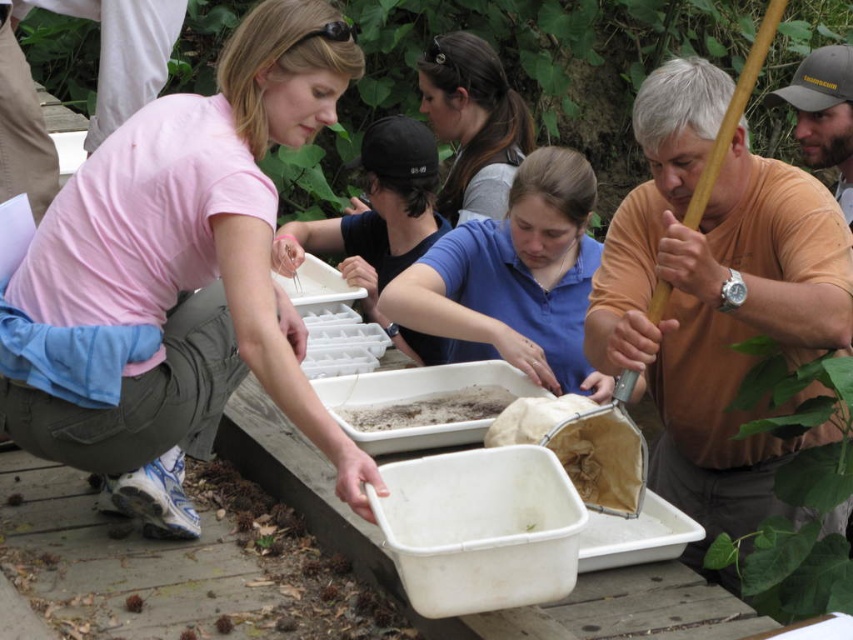
Can you confirm if smooth brown hair at center is smaller than dark brown textured soil at center?

No.

Between smooth brown hair at center and dark brown textured soil at center, which one has more height?

Standing taller between the two is smooth brown hair at center.

What do you see at coordinates (473, 122) in the screenshot? The width and height of the screenshot is (853, 640). I see `smooth brown hair at center` at bounding box center [473, 122].

Identify the location of smooth brown hair at center. (473, 122).

Does blue matte shirt at center appear over smooth brown hair at center?

No, blue matte shirt at center is not above smooth brown hair at center.

You are a GUI agent. You are given a task and a screenshot of the screen. Output one action in this format:
    pyautogui.click(x=<x>, y=<y>)
    Task: Click on the blue matte shirt at center
    
    Given the screenshot: What is the action you would take?
    click(514, 280)

Find the location of a particular element. This screenshot has width=853, height=640. blue matte shirt at center is located at coordinates (514, 280).

Is point (784, 604) closer to viewer compared to point (337, 410)?

Yes, it is.

Image resolution: width=853 pixels, height=640 pixels. I want to click on green leafy plant at right, so click(796, 492).